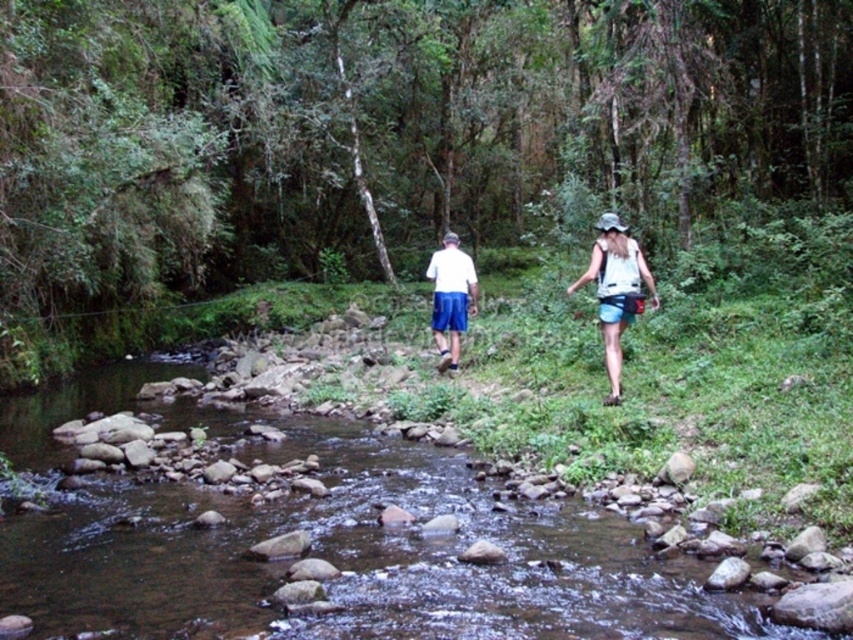
Can you confirm if clear water at stream center is shorter than white matte shorts at center?

Indeed, clear water at stream center has a lesser height compared to white matte shorts at center.

Is clear water at stream center to the right of white matte shorts at center from the viewer's perspective?

In fact, clear water at stream center is to the left of white matte shorts at center.

Who is more distant from viewer, (120,509) or (445,369)?

The point (445,369) is behind.

I want to click on clear water at stream center, so click(334, 541).

Who is positioned more to the right, clear water at stream center or white cotton tank top at center?

Positioned to the right is white cotton tank top at center.

Which of these two, clear water at stream center or white cotton tank top at center, stands taller?

white cotton tank top at center is taller.

I want to click on clear water at stream center, so click(x=334, y=541).

What do you see at coordinates (334, 541) in the screenshot? Image resolution: width=853 pixels, height=640 pixels. I see `clear water at stream center` at bounding box center [334, 541].

Which is below, clear water at stream center or white cotton shirt at center?

clear water at stream center is lower down.

Who is more distant from viewer, (102, 572) or (646, 275)?

The point (646, 275) is more distant.

This screenshot has height=640, width=853. I want to click on clear water at stream center, so click(x=334, y=541).